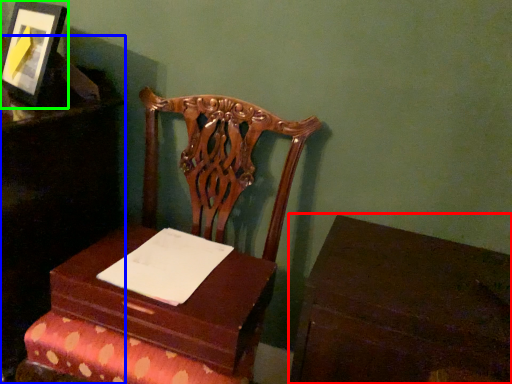
Question: Which object is the closest to the table (highlighted by a red box)? Choose among these: furniture (highlighted by a blue box) or picture frame (highlighted by a green box).

Choices:
 (A) furniture
 (B) picture frame

Answer: (A)